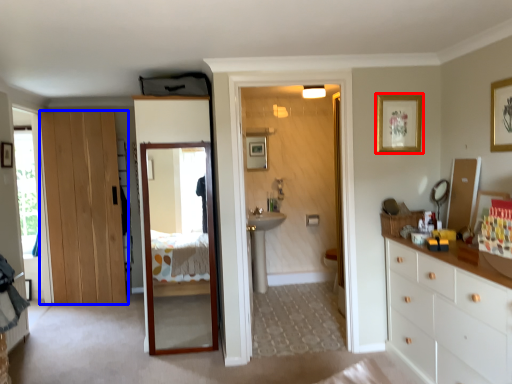
Question: Among these objects, which one is nearest to the camera, picture frame (highlighted by a red box) or door (highlighted by a blue box)?

Choices:
 (A) picture frame
 (B) door

Answer: (A)